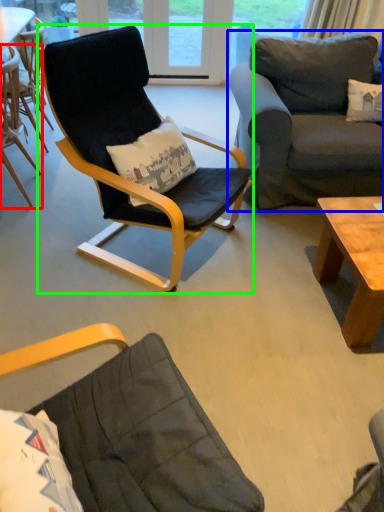
Question: Considering the real-world distances, which object is closest to chair (highlighted by a red box)? studio couch (highlighted by a blue box) or chair (highlighted by a green box).

Choices:
 (A) studio couch
 (B) chair

Answer: (B)